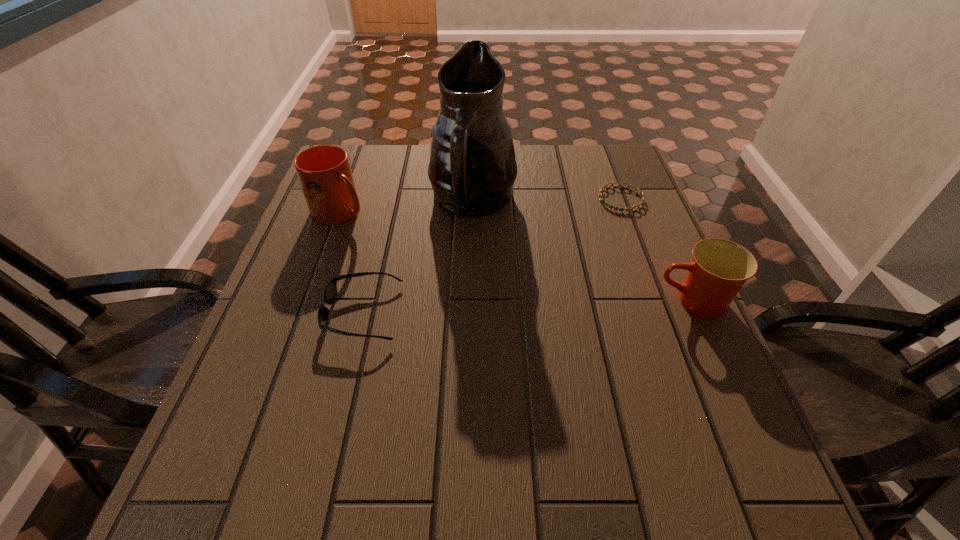
The image size is (960, 540). In order to click on vacant space on the desktop that is between the second shortest object and the cup and is positioned on the handle side of the second tallest object in this screenshot , I will do `click(504, 308)`.

You are a GUI agent. You are given a task and a screenshot of the screen. Output one action in this format:
    pyautogui.click(x=<x>, y=<y>)
    Task: Click on the vacant spot on the desktop that is between the second shortest object and the cup and is positioned from the spout of the pitcher
    
    Given the screenshot: What is the action you would take?
    pyautogui.click(x=564, y=306)

Locate an element on the screen. free space on the desktop that is between the sunglasses and the cup and is positioned on the surface of the bracelet showing star-shaped elements is located at coordinates (521, 307).